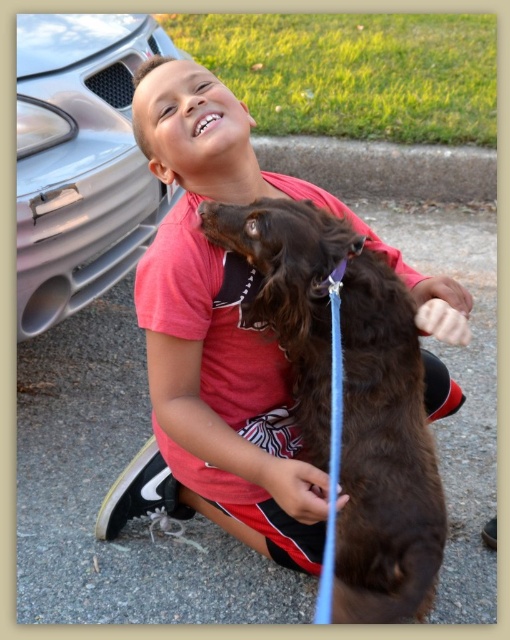
You are a photographer trying to capture a picture of the brown furry dog at center. Since the matte red shirt at center is blocking the view, can you lower your camera to get a clear shot of the dog?

The matte red shirt at center is much taller than the brown furry dog at center, so lowering the camera might help to avoid the shirt blocking the view and allow a clear shot of the dog.

In the scene shown: You are standing at point (85,68) and want to walk to point (370,531). Is the point you want to reach in front of or behind you?

Point (370,531) is in front of point (85,68), so the point you want to reach is in front of you.